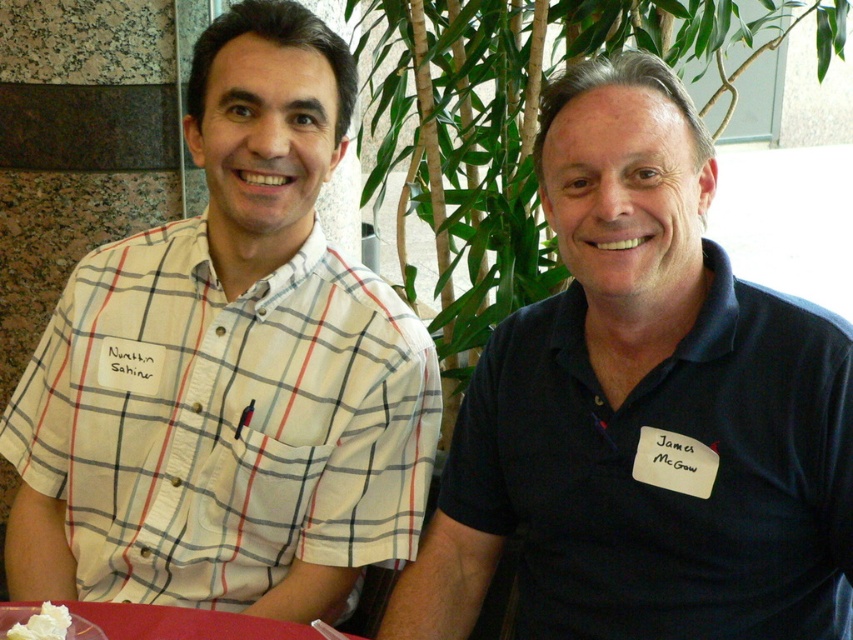
Question: Which object appears closest to the camera in this image?

Choices:
 (A) white creamy spread at lower left
 (B) dark blue polo shirt at right
 (C) smooth plastic table at lower left

Answer: (A)

Question: Is dark blue polo shirt at right smaller than white creamy spread at lower left?

Choices:
 (A) no
 (B) yes

Answer: (A)

Question: Is white checkered shirt at center thinner than dark blue polo shirt at right?

Choices:
 (A) no
 (B) yes

Answer: (A)

Question: Does smooth plastic table at lower left appear on the right side of white creamy spread at lower left?

Choices:
 (A) no
 (B) yes

Answer: (B)

Question: Which of the following is the farthest from the observer?

Choices:
 (A) (662, 433)
 (B) (228, 612)
 (C) (248, 172)
 (D) (51, 634)

Answer: (C)

Question: Among these points, which one is nearest to the camera?

Choices:
 (A) (39, 624)
 (B) (241, 449)

Answer: (A)